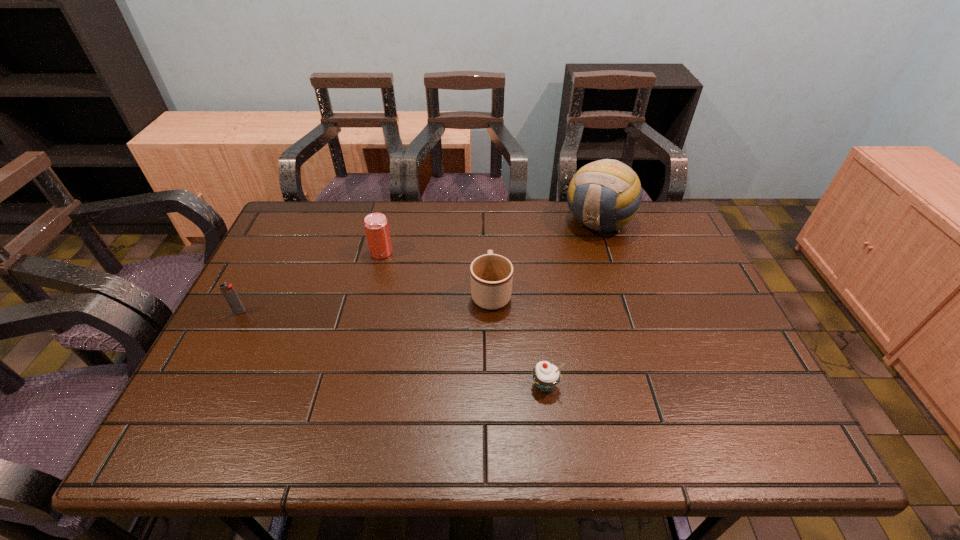
You are a GUI agent. You are given a task and a screenshot of the screen. Output one action in this format:
    pyautogui.click(x=<x>, y=<y>)
    Task: Click on the free space that satisfies the following two spatial constraints: 1. on the back side of the fourth object from left to right; 2. on the left side of the farthest object
    The width and height of the screenshot is (960, 540).
    Given the screenshot: What is the action you would take?
    pyautogui.click(x=525, y=221)